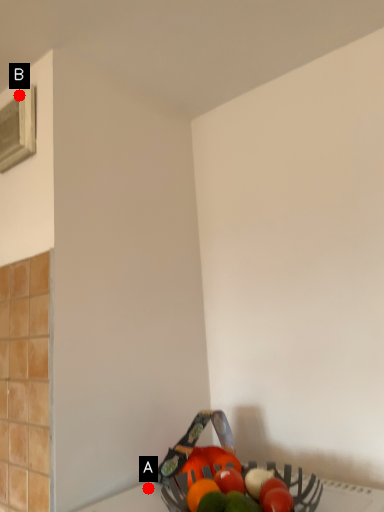
Question: Two points are circled on the image, labeled by A and B beside each circle. Which point appears closest to the camera in this image?

Choices:
 (A) A is closer
 (B) B is closer

Answer: (A)